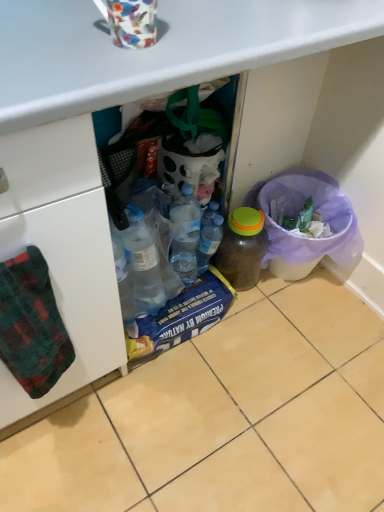
Question: Is translucent plastic bin at lower right with green plaid towel at left?

Choices:
 (A) no
 (B) yes

Answer: (A)

Question: Is translucent plastic bin at lower right at the right side of green plaid towel at left?

Choices:
 (A) yes
 (B) no

Answer: (A)

Question: Is green plaid towel at left at the back of translucent plastic bin at lower right?

Choices:
 (A) yes
 (B) no

Answer: (B)

Question: From a real-world perspective, is translucent plastic bin at lower right under green plaid towel at left?

Choices:
 (A) no
 (B) yes

Answer: (B)

Question: Is translucent plastic bin at lower right positioned beyond the bounds of green plaid towel at left?

Choices:
 (A) no
 (B) yes

Answer: (B)

Question: From the image's perspective, does translucent plastic bin at lower right appear lower than green plaid towel at left?

Choices:
 (A) yes
 (B) no

Answer: (B)

Question: Is the position of translucent plastic bin at lower right less distant than that of floral-patterned ceramic mug at upper center?

Choices:
 (A) no
 (B) yes

Answer: (A)

Question: Can you confirm if translucent plastic bin at lower right is positioned to the left of floral-patterned ceramic mug at upper center?

Choices:
 (A) no
 (B) yes

Answer: (A)

Question: From a real-world perspective, does translucent plastic bin at lower right sit lower than floral-patterned ceramic mug at upper center?

Choices:
 (A) yes
 (B) no

Answer: (A)

Question: Does translucent plastic bin at lower right lie behind floral-patterned ceramic mug at upper center?

Choices:
 (A) yes
 (B) no

Answer: (A)

Question: Is translucent plastic bin at lower right outside floral-patterned ceramic mug at upper center?

Choices:
 (A) yes
 (B) no

Answer: (A)

Question: Is translucent plastic bin at lower right facing towards floral-patterned ceramic mug at upper center?

Choices:
 (A) yes
 (B) no

Answer: (B)

Question: Considering the relative sizes of translucent plastic bin at lower right and translucent plastic bottle at center, which is the first bottle from left to right, in the image provided, is translucent plastic bin at lower right smaller than translucent plastic bottle at center, which is the first bottle from left to right,?

Choices:
 (A) yes
 (B) no

Answer: (B)